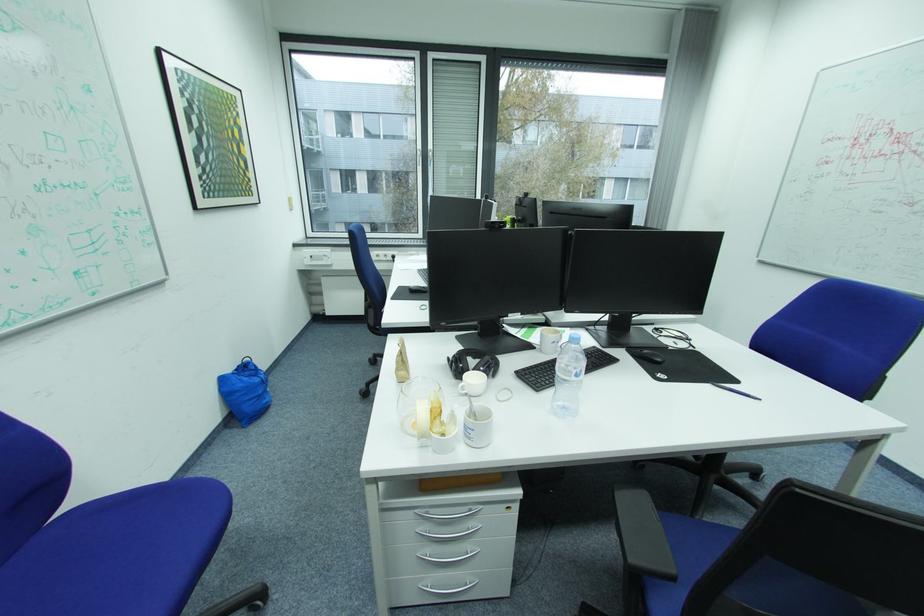
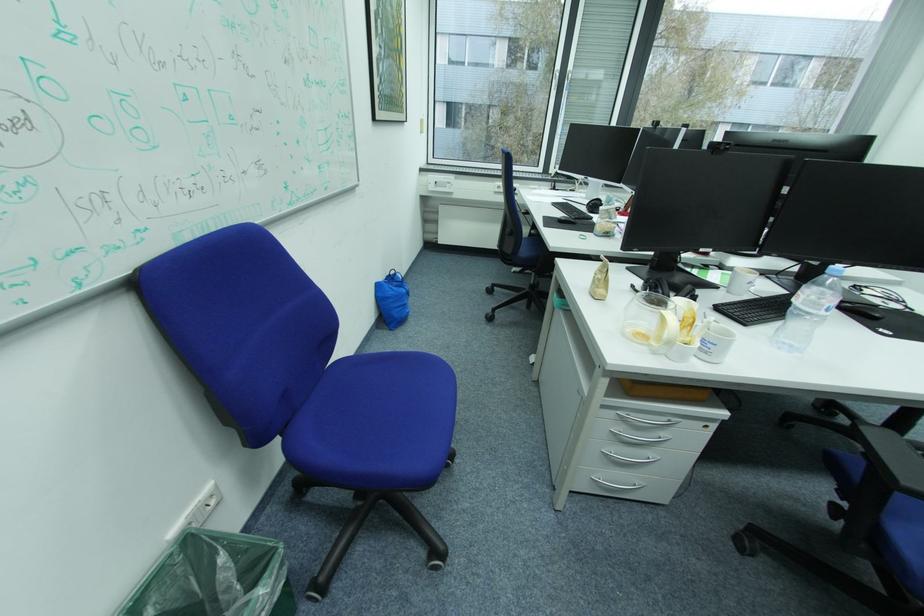
Question: Which direction would the cameraman need to move to produce the second image? Reply with the corresponding letter.

Choices:
 (A) Left
 (B) Right
 (C) Forward
 (D) Backward

Answer: (A)